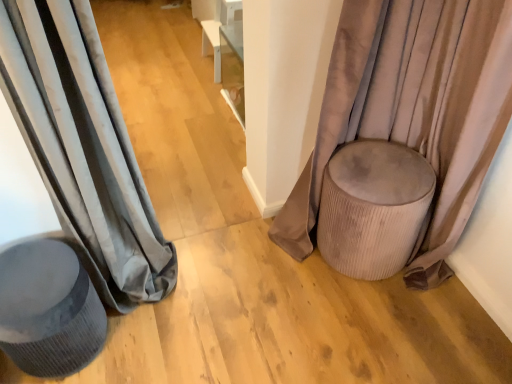
Find the location of a particular element. suede beige ottoman at right is located at coordinates (374, 208).

At what (x,y) coordinates should I click in order to perform the action: click on matte gray curtain at left, the 1th curtain viewed from the left. Please return your answer as a coordinate pair (x, y). This screenshot has height=384, width=512. Looking at the image, I should click on (83, 146).

What is the approximate width of matte gray curtain at left, the 2th curtain positioned from the right?

matte gray curtain at left, the 2th curtain positioned from the right, is 11.51 inches in width.

The height and width of the screenshot is (384, 512). Identify the location of suede beige ottoman at right. (374, 208).

Considering the relative sizes of velvet beige pouf at right, the 1th curtain positioned from the right, and suede beige ottoman at right in the image provided, is velvet beige pouf at right, the 1th curtain positioned from the right, taller than suede beige ottoman at right?

Correct, velvet beige pouf at right, the 1th curtain positioned from the right, is much taller as suede beige ottoman at right.

Can you confirm if velvet beige pouf at right, the 2th curtain viewed from the left, is wider than suede beige ottoman at right?

No.

From the picture: From the image's perspective, which is above, velvet beige pouf at right, the 1th curtain positioned from the right, or suede beige ottoman at right?

velvet beige pouf at right, the 1th curtain positioned from the right, is shown above in the image.

Who is smaller, velvet beige pouf at right, the 1th curtain positioned from the right, or suede beige ottoman at right?

Smaller between the two is suede beige ottoman at right.

Which point is more forward, (x=36, y=256) or (x=408, y=37)?

The point (x=36, y=256) is more forward.

From the image's perspective, who appears lower, matte gray stool at left or velvet beige pouf at right, the 2th curtain viewed from the left?

matte gray stool at left is shown below in the image.

Are matte gray stool at left and velvet beige pouf at right, the 1th curtain positioned from the right, beside each other?

matte gray stool at left is not next to velvet beige pouf at right, the 1th curtain positioned from the right, and they're not touching.

From their relative heights in the image, would you say matte gray stool at left is taller or shorter than velvet beige pouf at right, the 2th curtain viewed from the left?

In the image, matte gray stool at left appears to be shorter than velvet beige pouf at right, the 2th curtain viewed from the left.

Considering the relative positions of matte gray stool at left and suede beige ottoman at right in the image provided, is matte gray stool at left to the left of suede beige ottoman at right from the viewer's perspective?

Yes, matte gray stool at left is to the left of suede beige ottoman at right.

Is point (31, 344) more distant than point (389, 242)?

No, (31, 344) is closer to viewer.

Is matte gray stool at left behind suede beige ottoman at right?

No, the depth of matte gray stool at left is less than that of suede beige ottoman at right.

The image size is (512, 384). Identify the location of swivel chair that is under the suede beige ottoman at right (from a real-world perspective). (48, 309).

Who is smaller, matte gray curtain at left, the 2th curtain positioned from the right, or velvet beige pouf at right, the 2th curtain viewed from the left?

matte gray curtain at left, the 2th curtain positioned from the right, is smaller.

Is matte gray curtain at left, the 2th curtain positioned from the right, looking in the opposite direction of velvet beige pouf at right, the 2th curtain viewed from the left?

No, matte gray curtain at left, the 2th curtain positioned from the right, is not facing away from velvet beige pouf at right, the 2th curtain viewed from the left.

Does matte gray curtain at left, the 2th curtain positioned from the right, lie in front of velvet beige pouf at right, the 1th curtain positioned from the right?

Yes, matte gray curtain at left, the 2th curtain positioned from the right, is closer to the camera.

Choose the correct answer: Is suede beige ottoman at right inside velvet beige pouf at right, the 2th curtain viewed from the left, or outside it?

suede beige ottoman at right lies within the bounds of velvet beige pouf at right, the 2th curtain viewed from the left.

Is suede beige ottoman at right in contact with velvet beige pouf at right, the 2th curtain viewed from the left?

No, suede beige ottoman at right is not with velvet beige pouf at right, the 2th curtain viewed from the left.

Can you confirm if suede beige ottoman at right is thinner than velvet beige pouf at right, the 1th curtain positioned from the right?

No.

Which object is further away from the camera taking this photo, suede beige ottoman at right or velvet beige pouf at right, the 1th curtain positioned from the right?

suede beige ottoman at right is further away from the camera.

The height and width of the screenshot is (384, 512). What are the coordinates of `swivel chair lying below the suede beige ottoman at right (from the image's perspective)` in the screenshot? It's located at (48, 309).

Is suede beige ottoman at right not within matte gray stool at left?

That's correct, suede beige ottoman at right is outside of matte gray stool at left.

Between suede beige ottoman at right and matte gray stool at left, which one has more height?

suede beige ottoman at right.

Considering the sizes of matte gray stool at left and matte gray curtain at left, the 2th curtain positioned from the right, in the image, is matte gray stool at left bigger or smaller than matte gray curtain at left, the 2th curtain positioned from the right,?

Considering their sizes, matte gray stool at left takes up less space than matte gray curtain at left, the 2th curtain positioned from the right.

From a real-world perspective, between matte gray stool at left and matte gray curtain at left, the 1th curtain viewed from the left, who is vertically higher?

matte gray curtain at left, the 1th curtain viewed from the left, is physically above.

Is matte gray stool at left oriented away from matte gray curtain at left, the 1th curtain viewed from the left?

No, matte gray curtain at left, the 1th curtain viewed from the left, is not at the back of matte gray stool at left.

Consider the image. Considering the positions of objects matte gray stool at left and matte gray curtain at left, the 2th curtain positioned from the right, in the image provided, who is in front, matte gray stool at left or matte gray curtain at left, the 2th curtain positioned from the right,?

Positioned in front is matte gray curtain at left, the 2th curtain positioned from the right.

Locate an element on the screen. Image resolution: width=512 pixels, height=384 pixels. the 1st curtain in front of the suede beige ottoman at right is located at coordinates (414, 110).

Locate an element on the screen. This screenshot has height=384, width=512. swivel chair lying behind the velvet beige pouf at right, the 2th curtain viewed from the left is located at coordinates (48, 309).

Based on their spatial positions, is matte gray stool at left or velvet beige pouf at right, the 1th curtain positioned from the right, closer to matte gray curtain at left, the 2th curtain positioned from the right?

Based on the image, matte gray stool at left appears to be nearer to matte gray curtain at left, the 2th curtain positioned from the right.

Considering their positions, is matte gray curtain at left, the 2th curtain positioned from the right, positioned further to suede beige ottoman at right than matte gray stool at left?

Based on the image, matte gray stool at left appears to be further to suede beige ottoman at right.

Which object lies nearer to the anchor point suede beige ottoman at right, matte gray stool at left or velvet beige pouf at right, the 1th curtain positioned from the right?

Among the two, velvet beige pouf at right, the 1th curtain positioned from the right, is located nearer to suede beige ottoman at right.

Considering their positions, is velvet beige pouf at right, the 2th curtain viewed from the left, positioned further to matte gray curtain at left, the 2th curtain positioned from the right, than suede beige ottoman at right?

Based on the image, velvet beige pouf at right, the 2th curtain viewed from the left, appears to be further to matte gray curtain at left, the 2th curtain positioned from the right.

Considering their positions, is suede beige ottoman at right positioned closer to velvet beige pouf at right, the 1th curtain positioned from the right, than matte gray stool at left?

suede beige ottoman at right.

Based on their spatial positions, is matte gray stool at left or suede beige ottoman at right further from matte gray curtain at left, the 1th curtain viewed from the left?

suede beige ottoman at right is further to matte gray curtain at left, the 1th curtain viewed from the left.

Considering their positions, is suede beige ottoman at right positioned closer to matte gray curtain at left, the 2th curtain positioned from the right, than matte gray stool at left?

matte gray stool at left lies closer to matte gray curtain at left, the 2th curtain positioned from the right, than the other object.

Based on the photo, based on their spatial positions, is matte gray stool at left or matte gray curtain at left, the 2th curtain positioned from the right, further from velvet beige pouf at right, the 1th curtain positioned from the right?

matte gray stool at left.

At what (x,y) coordinates should I click in order to perform the action: click on curtain between matte gray curtain at left, the 2th curtain positioned from the right, and suede beige ottoman at right, in the horizontal direction. Please return your answer as a coordinate pair (x, y). Looking at the image, I should click on (414, 110).

Identify the location of curtain situated between matte gray stool at left and velvet beige pouf at right, the 2th curtain viewed from the left, from left to right. The image size is (512, 384). 83,146.